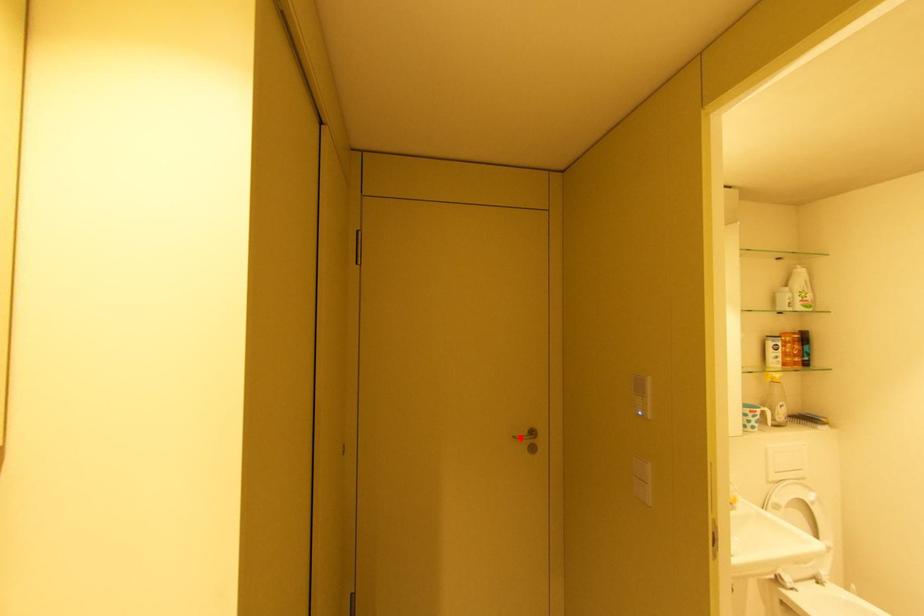
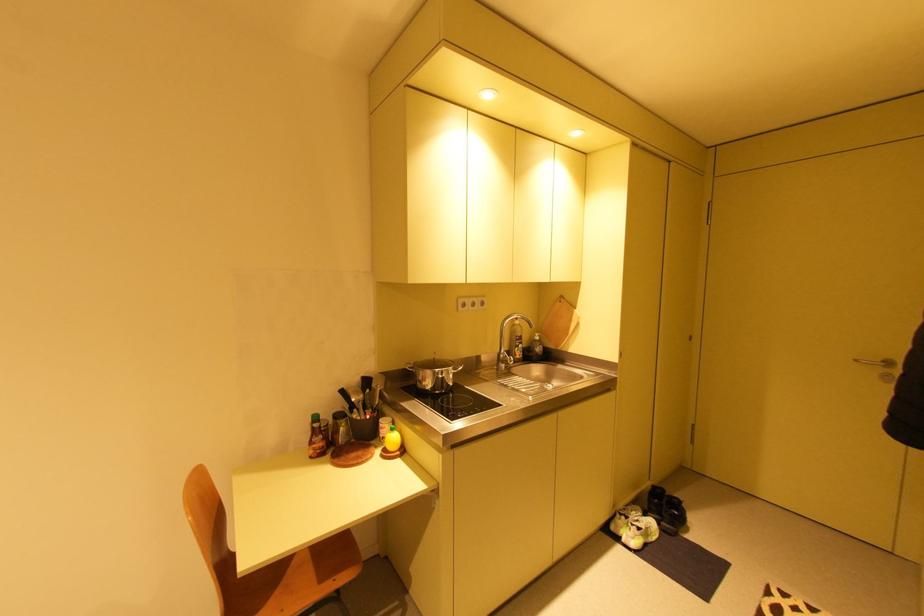
The point at the highlighted location is marked in the first image. Where is the corresponding point in the second image?

(861, 361)